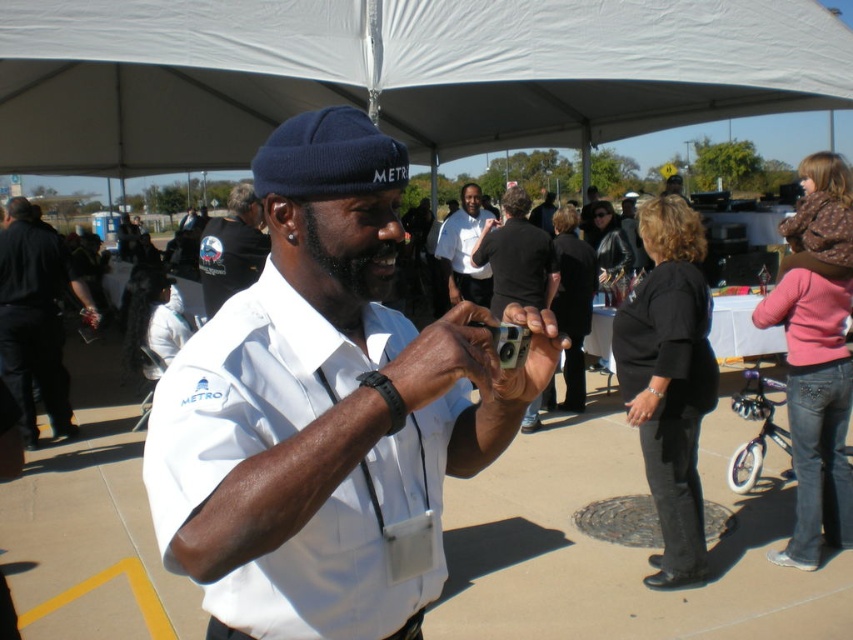
You are a photographer at the event and need to adjust your metallic gray camera at center. However, there is a black fabric jacket at left blocking your view. Can you move the camera to the right to get a better angle?

The metallic gray camera at center is behind the black fabric jacket at left, so moving it to the right might help avoid the obstruction.

You are at the event and want to take a photo of both the point at coordinates point (38, 372) and point (492, 339). Which point should you focus on first to ensure both are in clear view?

→ Point (38, 372) is closer to you than point (492, 339), so you should focus on point (38, 372) first to ensure both are in clear view.